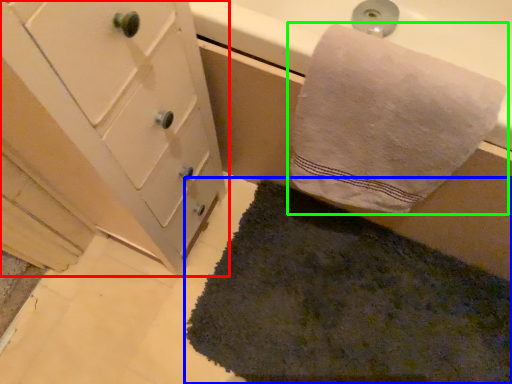
Question: Based on their relative distances, which object is nearer to bathroom cabinet (highlighted by a red box)? Choose from bath mat (highlighted by a blue box) and towel (highlighted by a green box).

Choices:
 (A) bath mat
 (B) towel

Answer: (B)